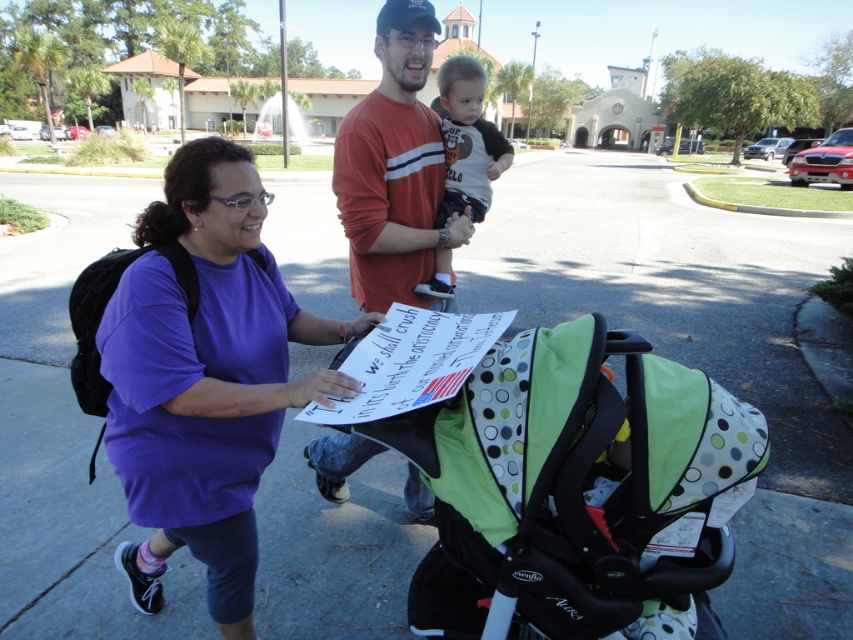
Is purple fabric shirt at center wider than orange cotton shirt at center?

Yes.

At what (x,y) coordinates should I click in order to perform the action: click on purple fabric shirt at center. Please return your answer as a coordinate pair (x, y). The image size is (853, 640). Looking at the image, I should click on (206, 378).

Does green polka dot fabric baby carriage at center appear on the left side of purple fabric shirt at center?

Incorrect, green polka dot fabric baby carriage at center is not on the left side of purple fabric shirt at center.

How far apart are green polka dot fabric baby carriage at center and purple fabric shirt at center?

A distance of 25.20 inches exists between green polka dot fabric baby carriage at center and purple fabric shirt at center.

Which is in front, point (750, 448) or point (252, 230)?

Positioned in front is point (750, 448).

Identify the location of green polka dot fabric baby carriage at center. The height and width of the screenshot is (640, 853). (573, 488).

Between point (659, 364) and point (426, 4), which one is positioned in front?

Positioned in front is point (659, 364).

You are a GUI agent. You are given a task and a screenshot of the screen. Output one action in this format:
    pyautogui.click(x=<x>, y=<y>)
    Task: Click on the green polka dot fabric baby carriage at center
    
    Given the screenshot: What is the action you would take?
    pyautogui.click(x=573, y=488)